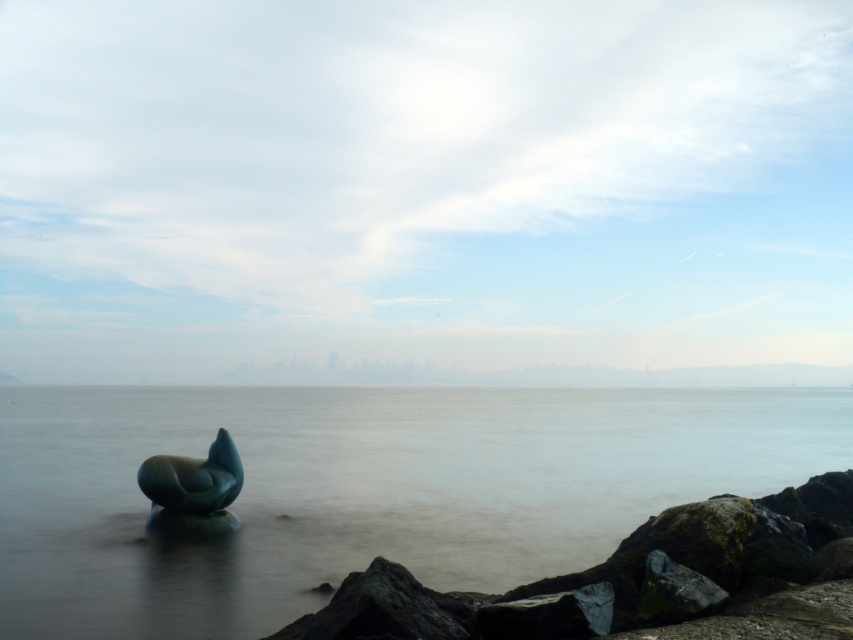
Does green metallic water at center have a lesser height compared to green polished stone sculpture at center?

No.

Which is more to the right, green metallic water at center or green polished stone sculpture at center?

green polished stone sculpture at center

The height and width of the screenshot is (640, 853). What do you see at coordinates (364, 490) in the screenshot?
I see `green metallic water at center` at bounding box center [364, 490].

Identify the location of green metallic water at center. (364, 490).